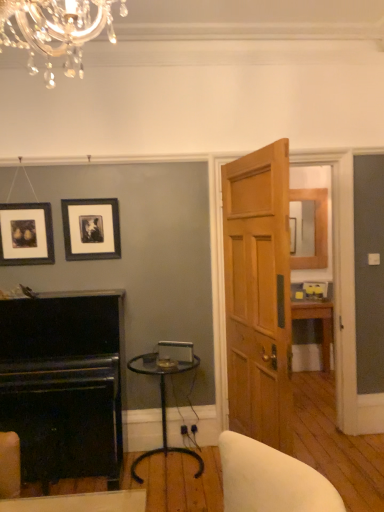
The height and width of the screenshot is (512, 384). What do you see at coordinates (63, 385) in the screenshot? I see `black polished wood fireplace at lower left` at bounding box center [63, 385].

What do you see at coordinates (26, 234) in the screenshot? This screenshot has width=384, height=512. I see `matte black picture frame at upper left, arranged as the first picture frame when viewed from the left` at bounding box center [26, 234].

Identify the location of clear glass table at center. (164, 401).

Find the location of `black polished wood fireplace at lower left`. black polished wood fireplace at lower left is located at coordinates 63,385.

From the image's perspective, which is above, light brown wooden door at center or clear glass table at center?

From the image's view, light brown wooden door at center is above.

From the picture: Are light brown wooden door at center and clear glass table at center located far from each other?

light brown wooden door at center is near clear glass table at center, not far away.

How many degrees apart are the facing directions of light brown wooden door at center and clear glass table at center?

102 degrees.

Which object is thinner, light brown wooden door at center or clear glass table at center?

light brown wooden door at center.

Based on the photo, looking at their sizes, would you say light brown wooden door at center is wider or thinner than matte black picture frame at upper left, the second picture frame positioned from the right?

In the image, light brown wooden door at center appears to be wider than matte black picture frame at upper left, the second picture frame positioned from the right.

In terms of size, does light brown wooden door at center appear bigger or smaller than matte black picture frame at upper left, the second picture frame positioned from the right?

Considering their sizes, light brown wooden door at center takes up more space than matte black picture frame at upper left, the second picture frame positioned from the right.

From the image's perspective, does light brown wooden door at center appear lower than matte black picture frame at upper left, arranged as the first picture frame when viewed from the left?

Correct, light brown wooden door at center appears lower than matte black picture frame at upper left, arranged as the first picture frame when viewed from the left, in the image.

Starting from the light brown wooden door at center, which picture frame is the 1st one behind? Please provide its 2D coordinates.

[(26, 234)]

Is clear glass table at center smaller than black matte picture frame at upper center, acting as the first picture frame starting from the right?

No, clear glass table at center is not smaller than black matte picture frame at upper center, acting as the first picture frame starting from the right.

From a real-world perspective, is clear glass table at center physically below black matte picture frame at upper center, acting as the first picture frame starting from the right?

Yes.

I want to click on table in front of the black matte picture frame at upper center, acting as the first picture frame starting from the right, so click(164, 401).

From the image's perspective, would you say matte black picture frame at upper left, arranged as the first picture frame when viewed from the left, is shown under black matte picture frame at upper center, placed as the second picture frame when sorted from left to right?

Yes.

Where is `picture frame behind the matte black picture frame at upper left, arranged as the first picture frame when viewed from the left`? picture frame behind the matte black picture frame at upper left, arranged as the first picture frame when viewed from the left is located at coordinates (91, 229).

From a real-world perspective, is matte black picture frame at upper left, arranged as the first picture frame when viewed from the left, positioned over black matte picture frame at upper center, placed as the second picture frame when sorted from left to right, based on gravity?

No, from a real-world perspective, matte black picture frame at upper left, arranged as the first picture frame when viewed from the left, is not above black matte picture frame at upper center, placed as the second picture frame when sorted from left to right.

Is matte black picture frame at upper left, the second picture frame positioned from the right, thinner than black matte picture frame at upper center, acting as the first picture frame starting from the right?

Yes.

Which object is closer to the camera, matte black picture frame at upper left, the second picture frame positioned from the right, or black polished wood fireplace at lower left?

Positioned in front is black polished wood fireplace at lower left.

Is point (47, 250) farther from camera compared to point (112, 478)?

That is True.

Are matte black picture frame at upper left, arranged as the first picture frame when viewed from the left, and black polished wood fireplace at lower left far apart?

matte black picture frame at upper left, arranged as the first picture frame when viewed from the left, is actually quite close to black polished wood fireplace at lower left.

Is point (119, 418) positioned in front of point (199, 467)?

Yes, it is in front of point (199, 467).

Between black polished wood fireplace at lower left and clear glass table at center, which one has less height?

clear glass table at center is shorter.

Is clear glass table at center surrounded by black polished wood fireplace at lower left?

Definitely not — clear glass table at center is not inside black polished wood fireplace at lower left.

How far apart are clear glass table at center and black polished wood fireplace at lower left?

20.96 inches.

Is clear glass table at center facing towards black polished wood fireplace at lower left?

No.

Is clear glass table at center wider than black polished wood fireplace at lower left?

Incorrect, the width of clear glass table at center does not surpass that of black polished wood fireplace at lower left.

Find the location of a particular element. The height and width of the screenshot is (512, 384). door that is above the clear glass table at center (from a real-world perspective) is located at coordinates (258, 294).

In order to click on the 1st picture frame behind the light brown wooden door at center, starting your count from the anchor in this screenshot , I will do `click(26, 234)`.

Based on their spatial positions, is matte black picture frame at upper left, arranged as the first picture frame when viewed from the left, or black polished wood fireplace at lower left further from clear glass table at center?

matte black picture frame at upper left, arranged as the first picture frame when viewed from the left, lies further to clear glass table at center than the other object.

When comparing their distances from matte black picture frame at upper left, arranged as the first picture frame when viewed from the left, does black matte picture frame at upper center, placed as the second picture frame when sorted from left to right, or light brown wooden door at center seem closer?

black matte picture frame at upper center, placed as the second picture frame when sorted from left to right, is closer to matte black picture frame at upper left, arranged as the first picture frame when viewed from the left.

Based on their spatial positions, is light brown wooden door at center or black polished wood fireplace at lower left closer to clear glass table at center?

Based on the image, black polished wood fireplace at lower left appears to be nearer to clear glass table at center.

When comparing their distances from light brown wooden door at center, does black polished wood fireplace at lower left or black matte picture frame at upper center, placed as the second picture frame when sorted from left to right, seem further?

Among the two, black polished wood fireplace at lower left is located further to light brown wooden door at center.

Looking at the image, which one is located closer to black matte picture frame at upper center, placed as the second picture frame when sorted from left to right, black polished wood fireplace at lower left or matte black picture frame at upper left, the second picture frame positioned from the right?

The object closer to black matte picture frame at upper center, placed as the second picture frame when sorted from left to right, is matte black picture frame at upper left, the second picture frame positioned from the right.

Considering their positions, is clear glass table at center positioned closer to black matte picture frame at upper center, placed as the second picture frame when sorted from left to right, than black polished wood fireplace at lower left?

black polished wood fireplace at lower left lies closer to black matte picture frame at upper center, placed as the second picture frame when sorted from left to right, than the other object.

In the scene shown: Which object lies nearer to the anchor point matte black picture frame at upper left, the second picture frame positioned from the right, light brown wooden door at center or black matte picture frame at upper center, acting as the first picture frame starting from the right?

black matte picture frame at upper center, acting as the first picture frame starting from the right, lies closer to matte black picture frame at upper left, the second picture frame positioned from the right, than the other object.

From the image, which object appears to be farther from black matte picture frame at upper center, placed as the second picture frame when sorted from left to right, clear glass table at center or matte black picture frame at upper left, arranged as the first picture frame when viewed from the left?

clear glass table at center.

What are the coordinates of `fireplace between matte black picture frame at upper left, the second picture frame positioned from the right, and clear glass table at center in the up-down direction` in the screenshot? It's located at (63, 385).

Locate an element on the screen. This screenshot has height=512, width=384. picture frame located between black polished wood fireplace at lower left and light brown wooden door at center in the left-right direction is located at coordinates (91, 229).

Identify the location of picture frame between matte black picture frame at upper left, the second picture frame positioned from the right, and light brown wooden door at center from left to right. The width and height of the screenshot is (384, 512). (91, 229).

This screenshot has width=384, height=512. Find the location of `picture frame between black matte picture frame at upper center, acting as the first picture frame starting from the right, and clear glass table at center, in the vertical direction`. picture frame between black matte picture frame at upper center, acting as the first picture frame starting from the right, and clear glass table at center, in the vertical direction is located at coordinates (26, 234).